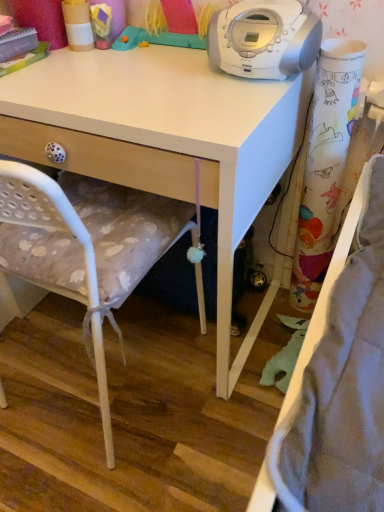
Question: From a real-world perspective, is white fabric chair at center above or below colorful paper curtain at right?

Choices:
 (A) above
 (B) below

Answer: (B)

Question: Considering their positions, is white fabric chair at center located in front of or behind colorful paper curtain at right?

Choices:
 (A) behind
 (B) front

Answer: (B)

Question: Estimate the real-world distances between objects in this image. Which object is closer to the colorful paper curtain at right?

Choices:
 (A) white fabric chair at center
 (B) white plastic stereo at upper center
 (C) white matte desk at upper center

Answer: (B)

Question: Which object is the closest to the colorful paper curtain at right?

Choices:
 (A) white fabric chair at center
 (B) white plastic stereo at upper center
 (C) white matte desk at upper center

Answer: (B)